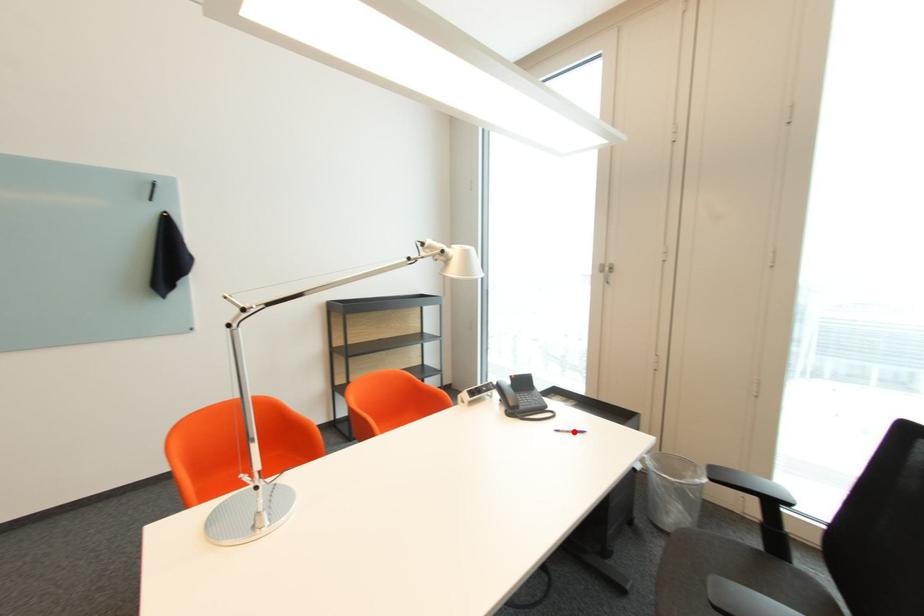
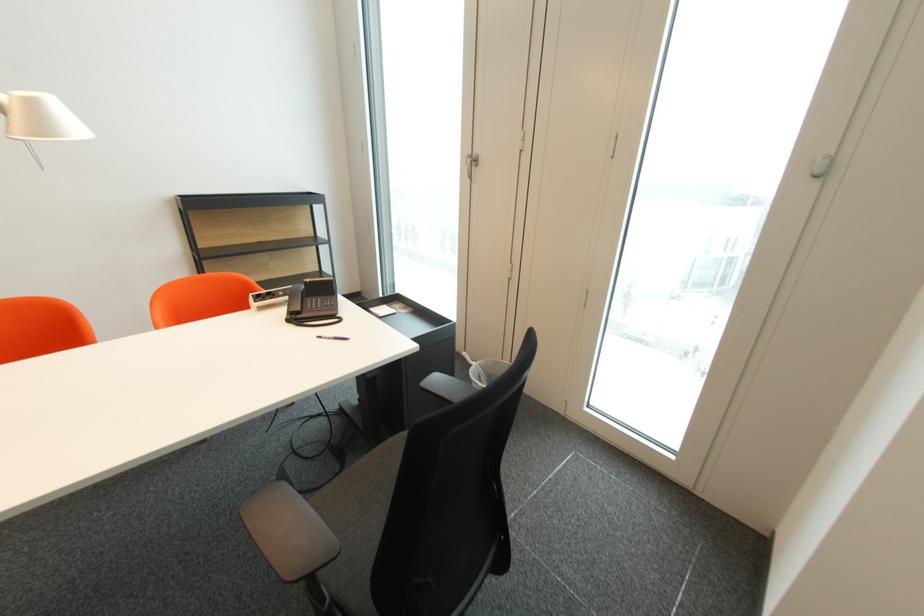
In the second image, find the point that corresponds to the highlighted location in the first image.

(336, 339)